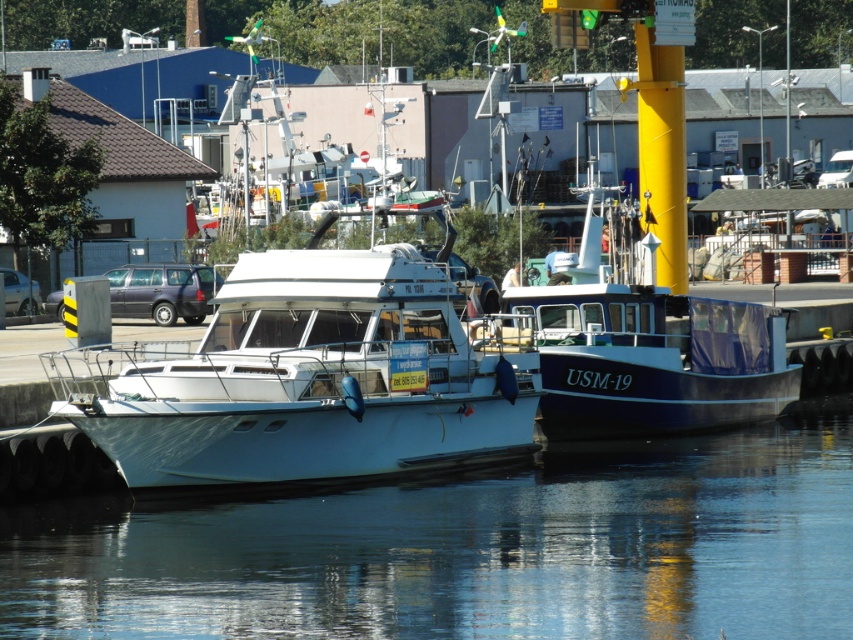
Question: Which point is closer to the camera?

Choices:
 (A) transparent water at lower center
 (B) white glossy boat at center

Answer: (A)

Question: Is transparent water at lower center positioned at the back of white glossy boat at center?

Choices:
 (A) no
 (B) yes

Answer: (A)

Question: From the image, what is the correct spatial relationship of transparent water at lower center in relation to white glossy boat at center?

Choices:
 (A) below
 (B) above

Answer: (A)

Question: Which of the following is the farthest from the observer?

Choices:
 (A) white glossy boat at center
 (B) transparent water at lower center

Answer: (A)

Question: Does transparent water at lower center appear over white glossy boat at center?

Choices:
 (A) yes
 (B) no

Answer: (B)

Question: Among these objects, which one is farthest from the camera?

Choices:
 (A) transparent water at lower center
 (B) white glossy boat at center

Answer: (B)